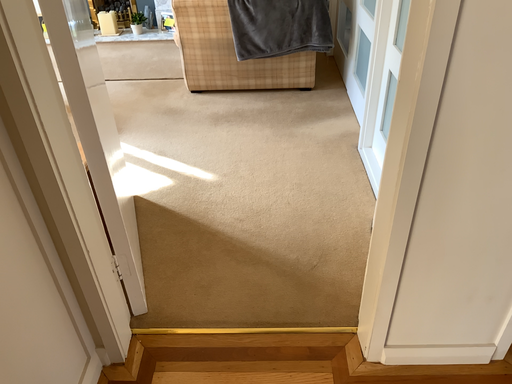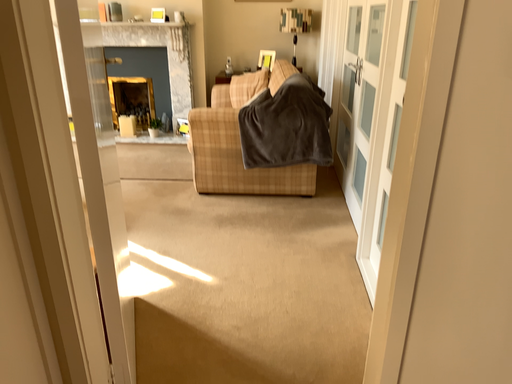
Question: Which way did the camera rotate in the video?

Choices:
 (A) rotated downward
 (B) rotated upward

Answer: (B)